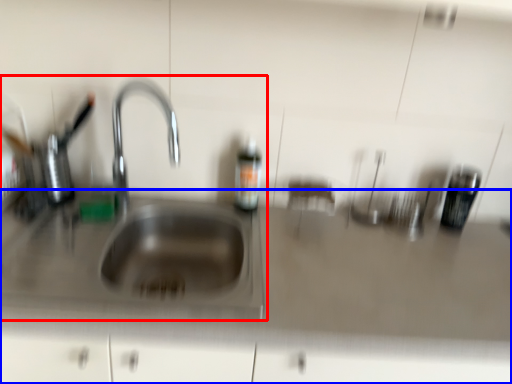
Question: Which point is closer to the camera, sink (highlighted by a red box) or counter top (highlighted by a blue box)?

Choices:
 (A) sink
 (B) counter top

Answer: (A)